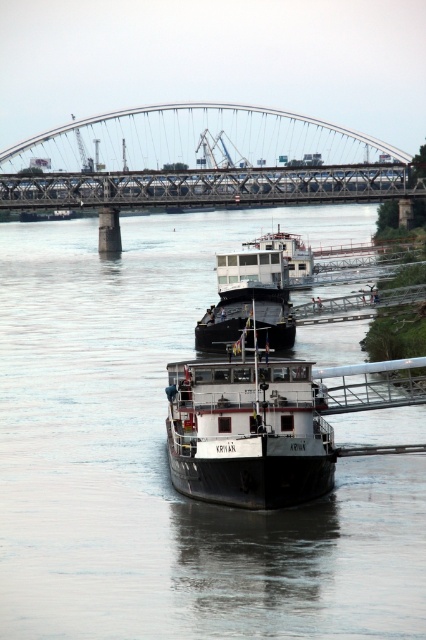
Question: Is black matte barge at center closer to camera compared to metallic gray bridge at upper center?

Choices:
 (A) no
 (B) yes

Answer: (B)

Question: Can you confirm if metallic gray bridge at upper center is thinner than white matte barge at center?

Choices:
 (A) yes
 (B) no

Answer: (B)

Question: Estimate the real-world distances between objects in this image. Which object is closer to the black matte barge at center?

Choices:
 (A) metallic gray bridge at upper center
 (B) white matte barge at center

Answer: (B)

Question: Considering the relative positions of metallic gray bridge at upper center and white matte barge at center in the image provided, where is metallic gray bridge at upper center located with respect to white matte barge at center?

Choices:
 (A) left
 (B) right

Answer: (A)

Question: Which object is positioned farthest from the metallic gray bridge at upper center?

Choices:
 (A) white matte barge at center
 (B) black matte barge at center

Answer: (A)

Question: Which of these objects is positioned closest to the metallic gray bridge at upper center?

Choices:
 (A) white matte barge at center
 (B) black matte barge at center

Answer: (B)